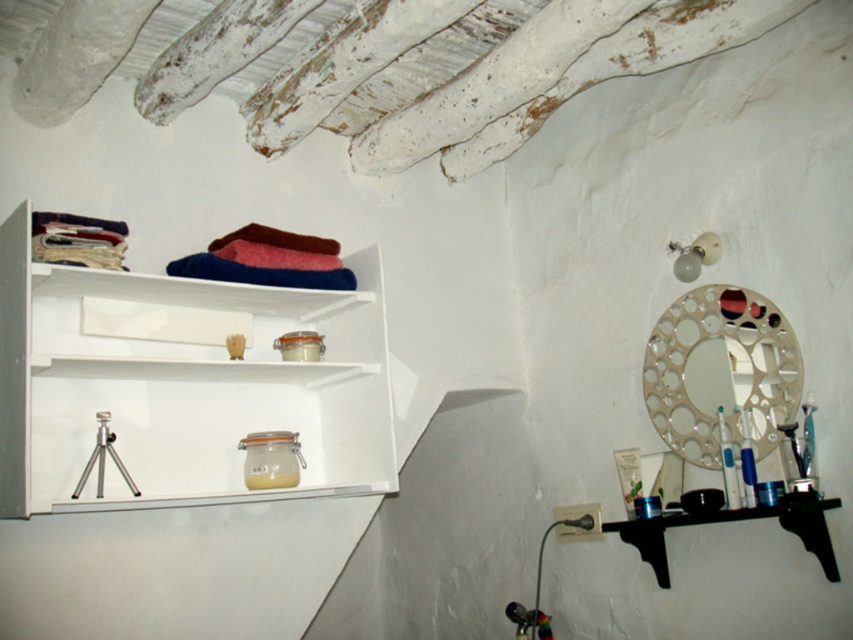
You are standing in the bathroom and want to reach both points. Which point, point (712,368) or point (660,568), is closer to you?

Point (712,368) is closer to you than point (660,568).

You need to place a large decorative vase that requires a wide surface. Looking at the white glossy shelves at upper left and the black wood shelf at lower right, which one is more suitable for placing the vase based on their widths?

The white glossy shelves at upper left might be wider than black wood shelf at lower right, so it is more suitable for placing the large decorative vase.